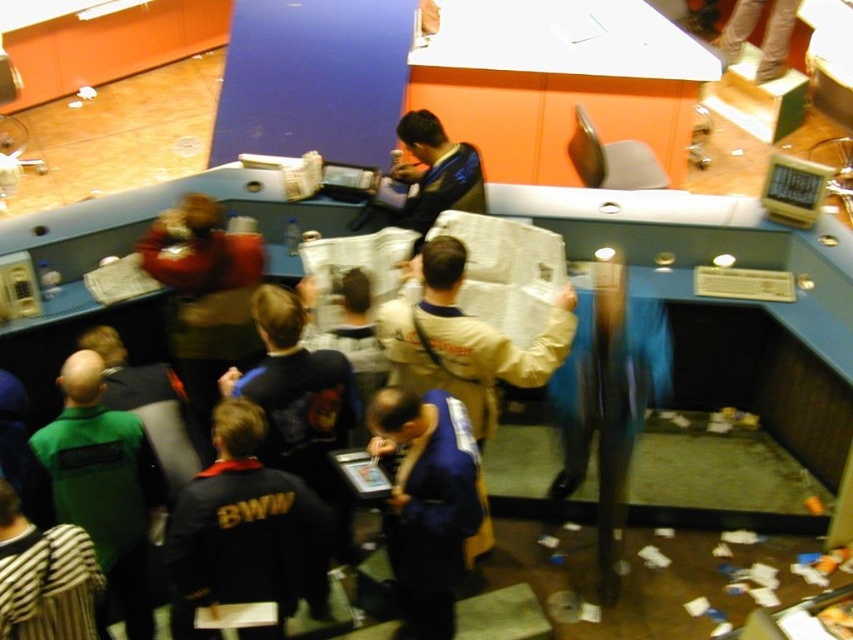
Question: Which point is closer to the camera?

Choices:
 (A) blue fabric shirt at center
 (B) khaki fabric jacket at center

Answer: (A)

Question: Can you confirm if blue fabric shirt at center is positioned to the left of khaki fabric jacket at center?

Choices:
 (A) no
 (B) yes

Answer: (B)

Question: Does green fleece jacket at left lie in front of khaki fabric jacket at center?

Choices:
 (A) yes
 (B) no

Answer: (A)

Question: Is blue fabric shirt at center wider than khaki fabric jacket at center?

Choices:
 (A) yes
 (B) no

Answer: (B)

Question: Which point appears closest to the camera in this image?

Choices:
 (A) (404, 564)
 (B) (418, 342)

Answer: (A)

Question: Which is farther from the blue fabric shirt at center?

Choices:
 (A) green fleece jacket at left
 (B) khaki fabric jacket at center

Answer: (A)